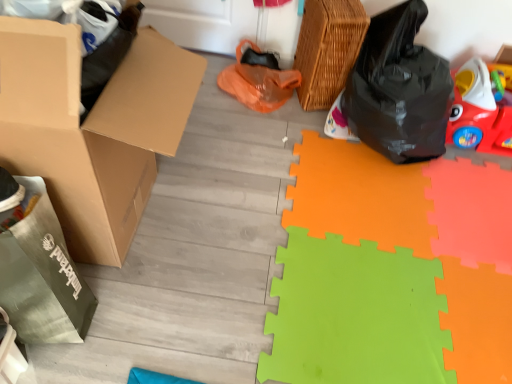
Question: Can you confirm if brown cardboard box at left is taller than green foam mat at lower right?

Choices:
 (A) no
 (B) yes

Answer: (B)

Question: Is brown cardboard box at left with green foam mat at lower right?

Choices:
 (A) no
 (B) yes

Answer: (A)

Question: Could you tell me if brown cardboard box at left is facing green foam mat at lower right?

Choices:
 (A) no
 (B) yes

Answer: (B)

Question: Is the depth of brown cardboard box at left less than that of green foam mat at lower right?

Choices:
 (A) yes
 (B) no

Answer: (A)

Question: From a real-world perspective, is brown cardboard box at left physically above green foam mat at lower right?

Choices:
 (A) no
 (B) yes

Answer: (B)

Question: Based on their sizes in the image, would you say woven brown basket at upper right is bigger or smaller than brown cardboard box at left?

Choices:
 (A) big
 (B) small

Answer: (B)

Question: Is woven brown basket at upper right taller or shorter than brown cardboard box at left?

Choices:
 (A) tall
 (B) short

Answer: (B)

Question: Visually, is woven brown basket at upper right positioned to the left or to the right of brown cardboard box at left?

Choices:
 (A) left
 (B) right

Answer: (B)

Question: Is point (330, 14) positioned closer to the camera than point (105, 220)?

Choices:
 (A) closer
 (B) farther

Answer: (B)

Question: Does point (320, 79) appear closer or farther from the camera than point (482, 119)?

Choices:
 (A) farther
 (B) closer

Answer: (A)

Question: From a real-world perspective, is woven brown basket at upper right physically located above or below rubberized red car at right?

Choices:
 (A) below
 (B) above

Answer: (B)

Question: Is woven brown basket at upper right wider or thinner than rubberized red car at right?

Choices:
 (A) wide
 (B) thin

Answer: (B)

Question: Considering the positions of woven brown basket at upper right and rubberized red car at right in the image, is woven brown basket at upper right bigger or smaller than rubberized red car at right?

Choices:
 (A) big
 (B) small

Answer: (B)

Question: Considering the relative positions of rubberized red car at right and brown cardboard box at left in the image provided, is rubberized red car at right to the left or to the right of brown cardboard box at left?

Choices:
 (A) left
 (B) right

Answer: (B)

Question: From a real-world perspective, is rubberized red car at right above or below brown cardboard box at left?

Choices:
 (A) below
 (B) above

Answer: (A)